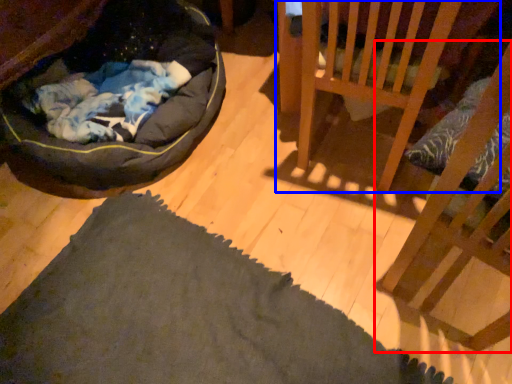
Question: Among these objects, which one is farthest to the camera, furniture (highlighted by a red box) or furniture (highlighted by a blue box)?

Choices:
 (A) furniture
 (B) furniture

Answer: (B)